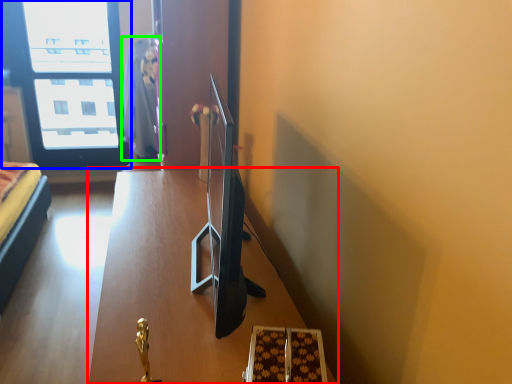
Question: Considering the real-world distances, which object is closest to table (highlighted by a red box)? window (highlighted by a blue box) or robe (highlighted by a green box).

Choices:
 (A) window
 (B) robe

Answer: (B)